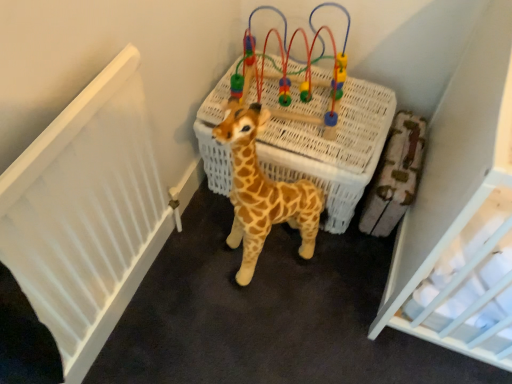
Where is `free space to the left of spotted plush giraffe at center`? free space to the left of spotted plush giraffe at center is located at coordinates (183, 257).